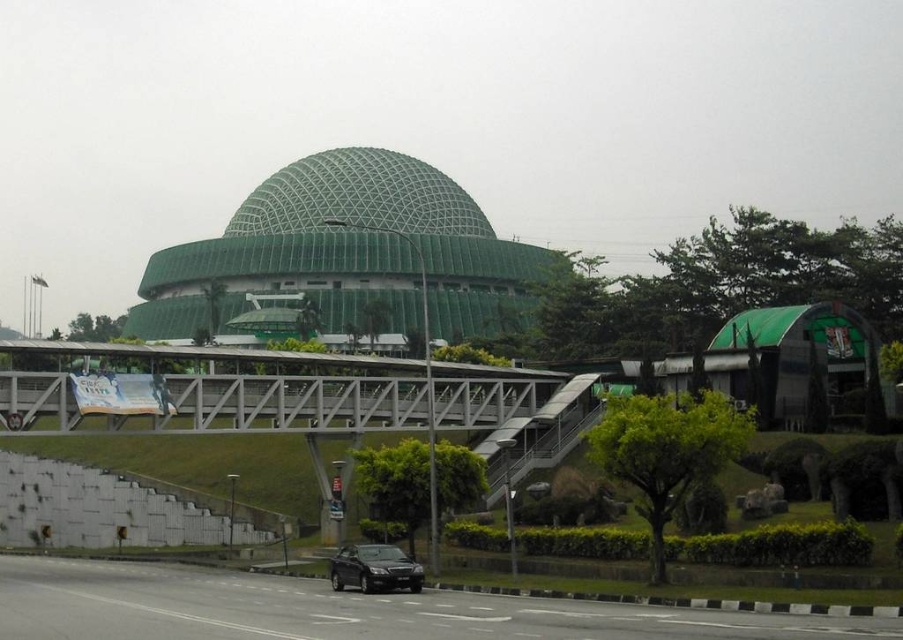
Question: Which point is farther to the camera?

Choices:
 (A) white concrete pedestrian bridge at center
 (B) green mesh dome at center
 (C) matte black car at lower center

Answer: (B)

Question: Does white concrete pedestrian bridge at center have a smaller size compared to black asphalt highway at lower center?

Choices:
 (A) yes
 (B) no

Answer: (A)

Question: Estimate the real-world distances between objects in this image. Which object is closer to the white concrete pedestrian bridge at center?

Choices:
 (A) green mesh dome at center
 (B) matte black car at lower center
 (C) black asphalt highway at lower center

Answer: (B)

Question: Is black asphalt highway at lower center below matte black car at lower center?

Choices:
 (A) yes
 (B) no

Answer: (B)

Question: Considering the real-world distances, which object is farthest from the white concrete pedestrian bridge at center?

Choices:
 (A) black asphalt highway at lower center
 (B) matte black car at lower center

Answer: (A)

Question: Is black asphalt highway at lower center thinner than green mesh dome at center?

Choices:
 (A) no
 (B) yes

Answer: (B)